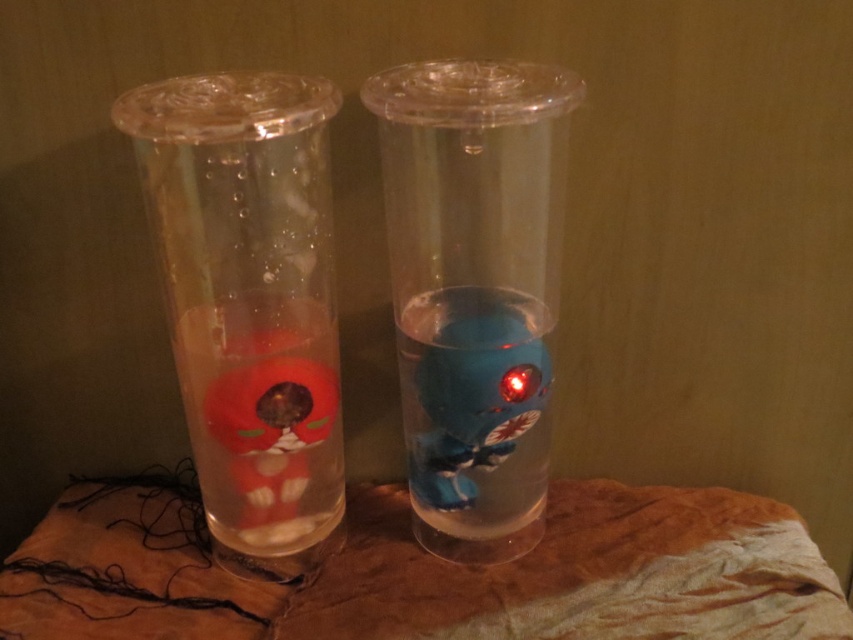
You have two containers in front of you, a matte plastic cup at left and a transparent plastic vase at center. Which one can hold more liquid?

The matte plastic cup at left is bigger than the transparent plastic vase at center, so it can hold more liquid.

Consider the image. You have a small toy car that is 10 centimeters long. You want to place it between the matte plastic cup at left and the transparent plastic vase at center. Will it fit without overlapping either object?

The distance between the matte plastic cup at left and the transparent plastic vase at center is 12.69 centimeters. Since the toy car is only 10 centimeters long, it will fit between them without overlapping either object.

You are arranging items on a table and want to place a new item between the brown fabric at center and the matte plastic cup at left. Is there enough vertical space between them for the item?

The brown fabric at center is below the matte plastic cup at left, so there is vertical space between them. However, the exact height of the item needed to fit isn